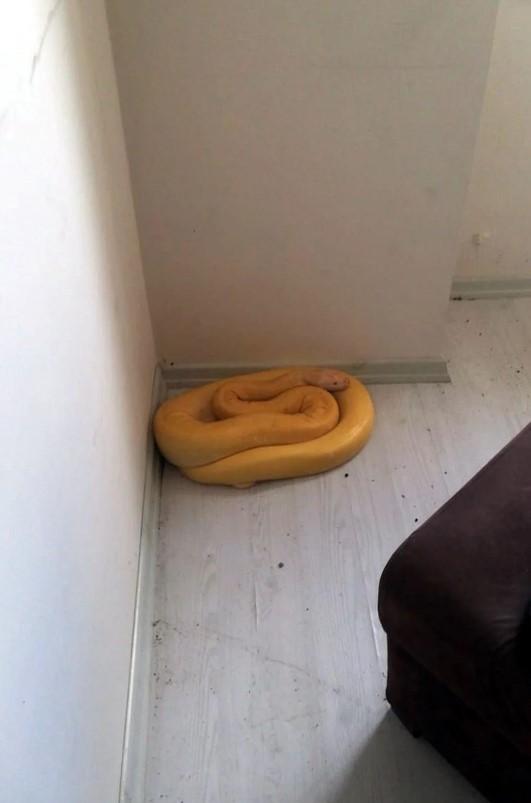
Find the location of a particular element. This screenshot has width=531, height=803. foot of furniture is located at coordinates (414, 728).